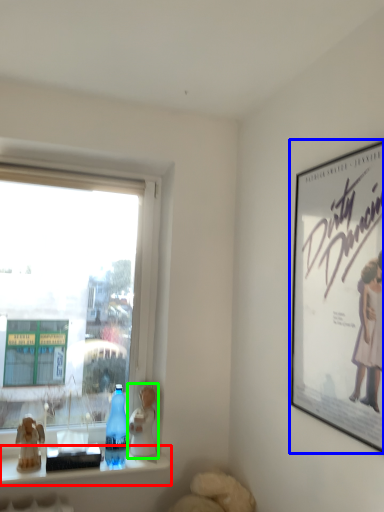
Question: Which object is the closest to the window sill (highlighted by a red box)? Choose among these: picture frame (highlighted by a blue box) or figurine (highlighted by a green box).

Choices:
 (A) picture frame
 (B) figurine

Answer: (B)